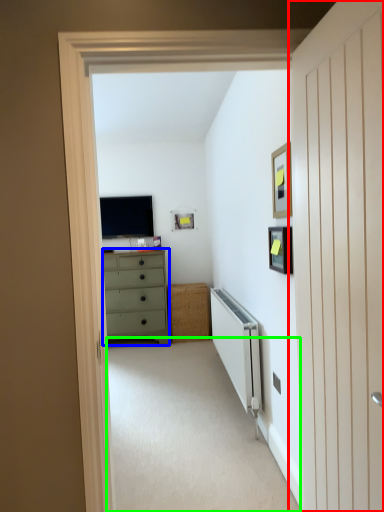
Question: Which object is positioned farthest from door (highlighted by a red box)? Select from chest of drawers (highlighted by a blue box) and corridor (highlighted by a green box).

Choices:
 (A) chest of drawers
 (B) corridor

Answer: (A)